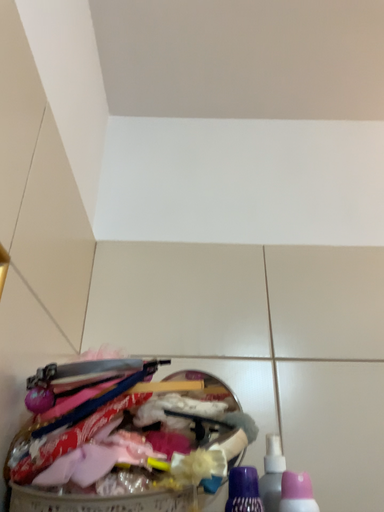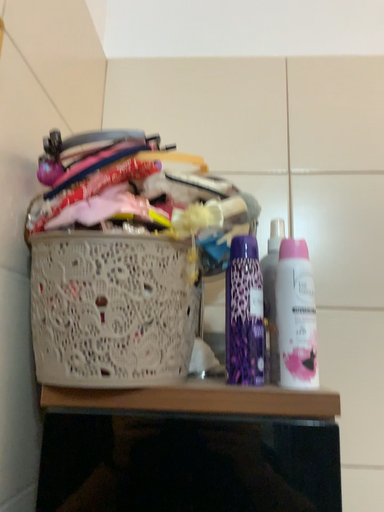
Question: Which way did the camera rotate in the video?

Choices:
 (A) rotated downward
 (B) rotated upward

Answer: (A)